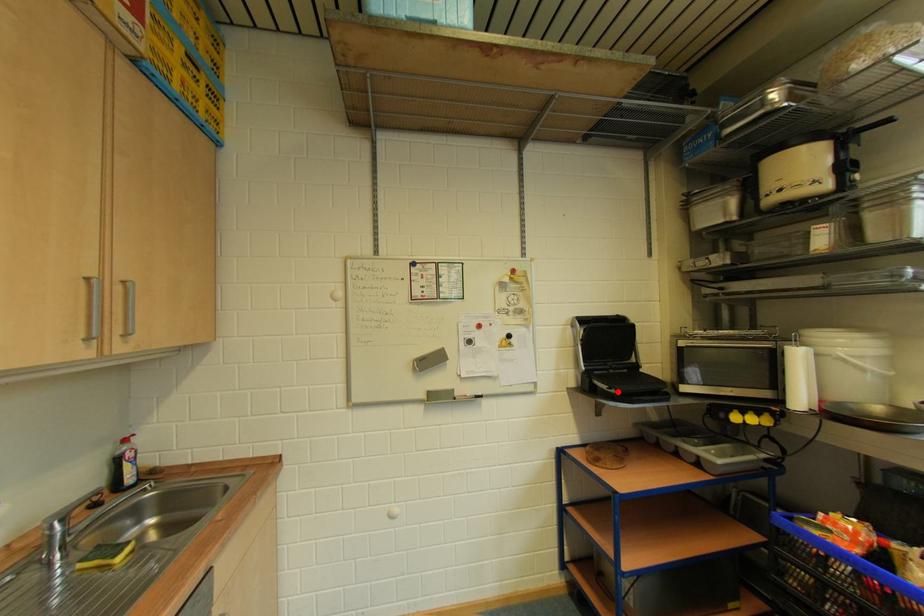
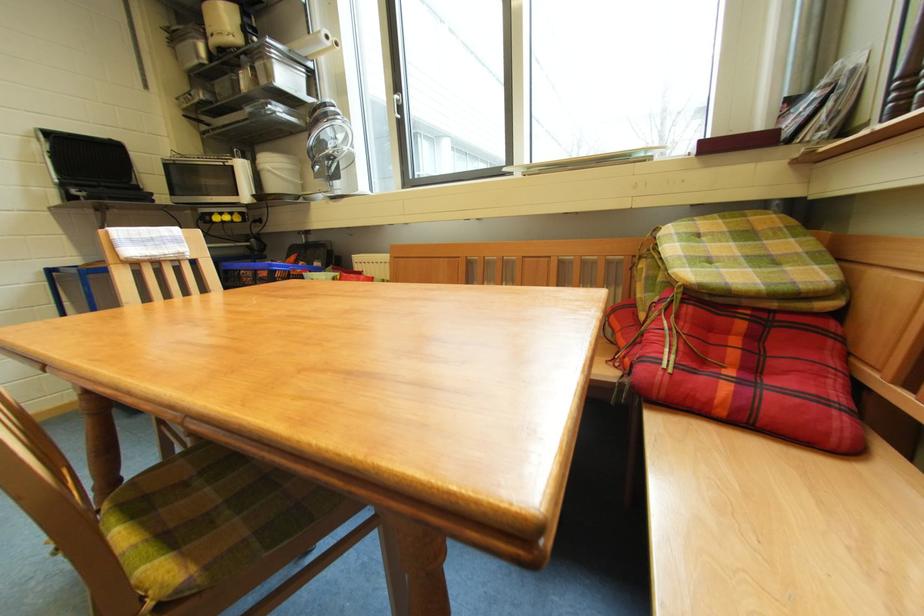
Question: A red point is marked in image1. In image2, is the corresponding 3D point closer to the camera or farther? Reply with the corresponding letter.

Choices:
 (A) The corresponding 3D point is closer.
 (B) The corresponding 3D point is farther.

Answer: (B)